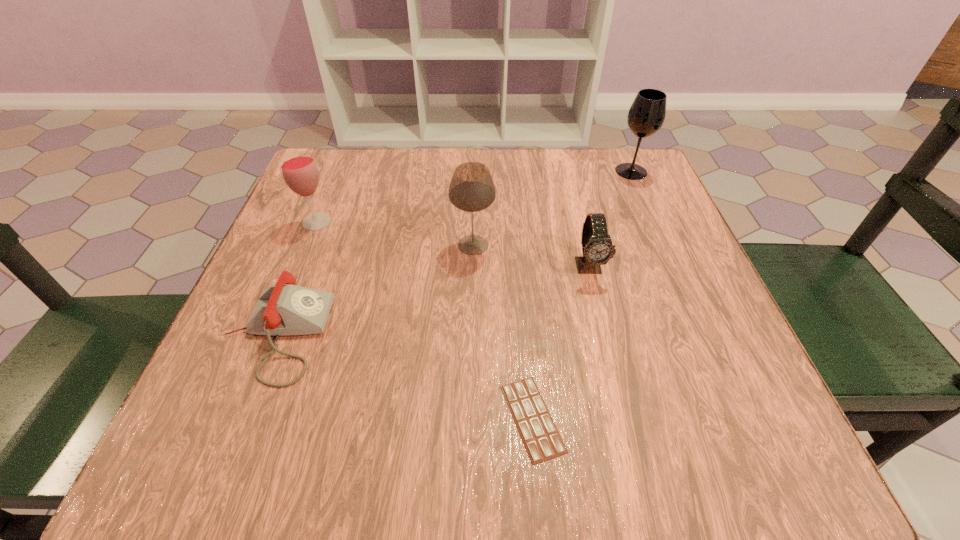
This screenshot has height=540, width=960. I want to click on vacant space that is in between the second wineglass from left to right and the chocolate bar, so click(503, 332).

Image resolution: width=960 pixels, height=540 pixels. Find the location of `free space that is in between the fifth tallest object and the rightmost object`. free space that is in between the fifth tallest object and the rightmost object is located at coordinates (454, 253).

Identify the location of free point between the rightmost object and the watch. [611, 219].

Identify the location of empty location between the third object from left to right and the third object from right to left. The width and height of the screenshot is (960, 540). (503, 332).

Where is `blank region between the leftmost wineglass and the shortest object`? The image size is (960, 540). blank region between the leftmost wineglass and the shortest object is located at coordinates (424, 320).

You are a GUI agent. You are given a task and a screenshot of the screen. Output one action in this format:
    pyautogui.click(x=<x>, y=<y>)
    Task: Click on the free space between the fourth object from left to right and the second object from right to left
    
    Given the screenshot: What is the action you would take?
    pyautogui.click(x=561, y=342)

Choose which object is the fifth nearest neighbor to the third object from left to right. Please provide its 2D coordinates. Your answer should be formatted as a tuple, i.e. [(x, y)], where the tuple contains the x and y coordinates of a point satisfying the conditions above.

[(646, 116)]

Image resolution: width=960 pixels, height=540 pixels. What are the coordinates of `object that stands as the closest to the second wineglass from right to left` in the screenshot? It's located at (597, 249).

This screenshot has width=960, height=540. Find the location of `the second closest wineglass relative to the telephone`. the second closest wineglass relative to the telephone is located at coordinates (472, 189).

Image resolution: width=960 pixels, height=540 pixels. In order to click on the closest wineglass to the third shortest object in this screenshot , I will do `click(472, 189)`.